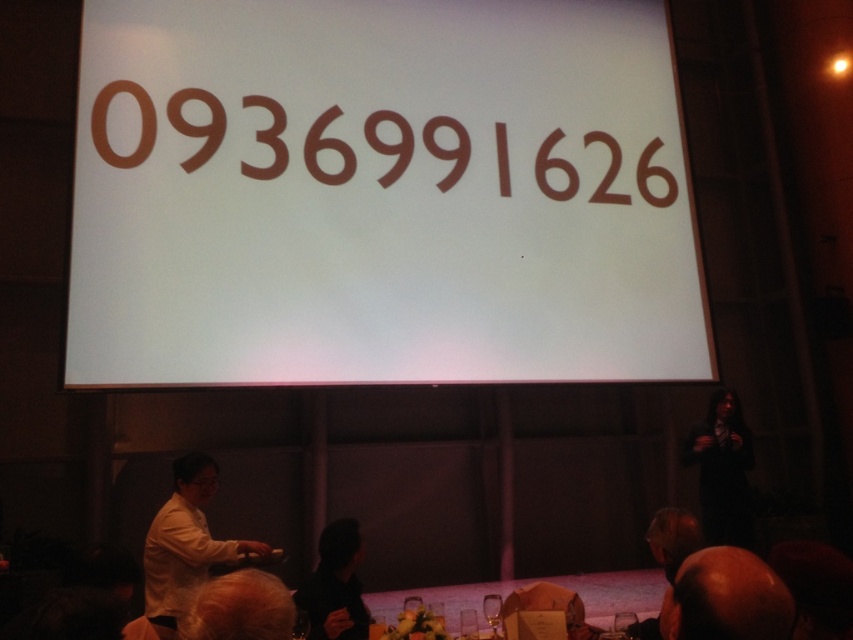
Question: Which object appears farthest from the camera in this image?

Choices:
 (A) white matte shirt at lower left
 (B) brown paper-like at upper center
 (C) black matte hair at lower center

Answer: (B)

Question: Which object is farther from the camera taking this photo?

Choices:
 (A) white matte shirt at lower left
 (B) dark fabric jacket at lower right
 (C) white glossy table at lower center

Answer: (B)

Question: Is blonde hair at lower center positioned before black matte hair at lower center?

Choices:
 (A) yes
 (B) no

Answer: (A)

Question: Does white matte shirt at lower left have a lesser width compared to black matte hair at lower center?

Choices:
 (A) no
 (B) yes

Answer: (A)

Question: Is smooth brown apple at lower right behind white matte shirt at lower left?

Choices:
 (A) no
 (B) yes

Answer: (A)

Question: Which of the following is the farthest from the observer?

Choices:
 (A) blonde hair at lower center
 (B) smooth brown apple at lower right

Answer: (A)